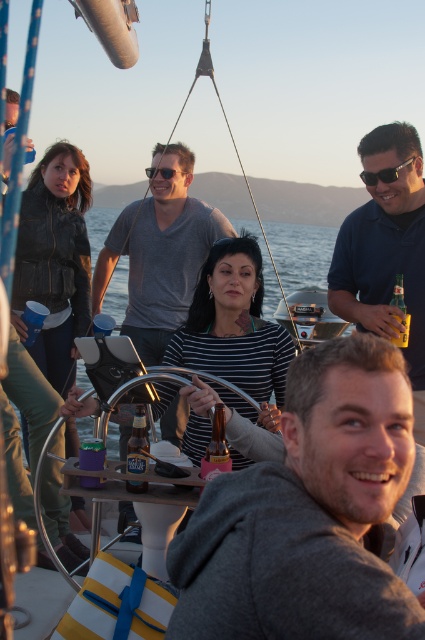
Question: Which object is closer to the camera taking this photo?

Choices:
 (A) matte gray shirt at center
 (B) gray hoodie at center

Answer: (B)

Question: Which object appears farthest from the camera in this image?

Choices:
 (A) translucent glass bottle at center
 (B) matte gray shirt at center

Answer: (B)

Question: Which of the following is the closest to the observer?

Choices:
 (A) matte gray shirt at center
 (B) blue polo shirt at upper right

Answer: (B)

Question: Can you confirm if blue polo shirt at upper right is thinner than translucent glass bottle at center?

Choices:
 (A) yes
 (B) no

Answer: (B)

Question: Does blue polo shirt at upper right have a lesser width compared to matte gray shirt at center?

Choices:
 (A) no
 (B) yes

Answer: (B)

Question: Does matte gray shirt at center appear on the right side of translucent glass bottle at center?

Choices:
 (A) no
 (B) yes

Answer: (A)